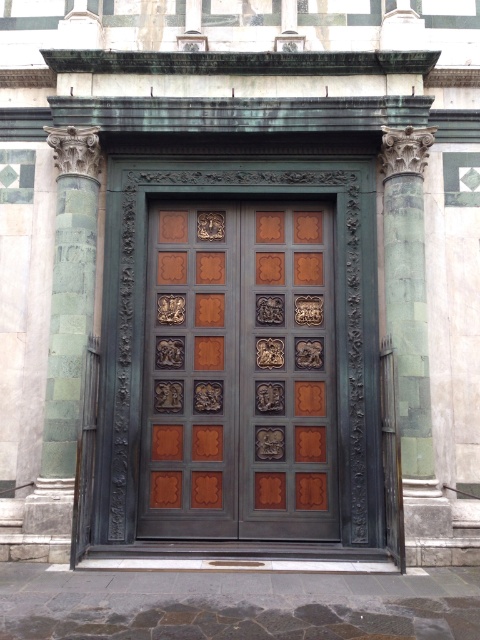
Question: Can you confirm if polished bronze door at center is wider than green marble column at right?

Choices:
 (A) no
 (B) yes

Answer: (B)

Question: Estimate the real-world distances between objects in this image. Which object is farther from the green marble column at right?

Choices:
 (A) polished bronze door at center
 (B) green marble column at left

Answer: (B)

Question: Does polished bronze door at center have a larger size compared to green marble column at right?

Choices:
 (A) yes
 (B) no

Answer: (B)

Question: Which is farther from the polished bronze door at center?

Choices:
 (A) green marble column at right
 (B) green marble column at left

Answer: (B)

Question: Which point is farther from the camera taking this photo?

Choices:
 (A) (164, 410)
 (B) (75, 355)
 (C) (432, 476)

Answer: (A)

Question: Is polished bronze door at center wider than green marble column at right?

Choices:
 (A) yes
 (B) no

Answer: (A)